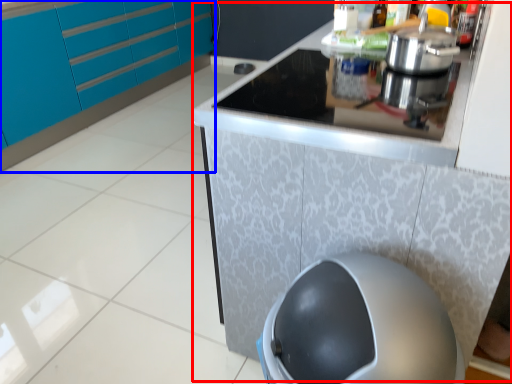
Question: Among these objects, which one is nearest to the camera, counter (highlighted by a red box) or cabinetry (highlighted by a blue box)?

Choices:
 (A) counter
 (B) cabinetry

Answer: (A)